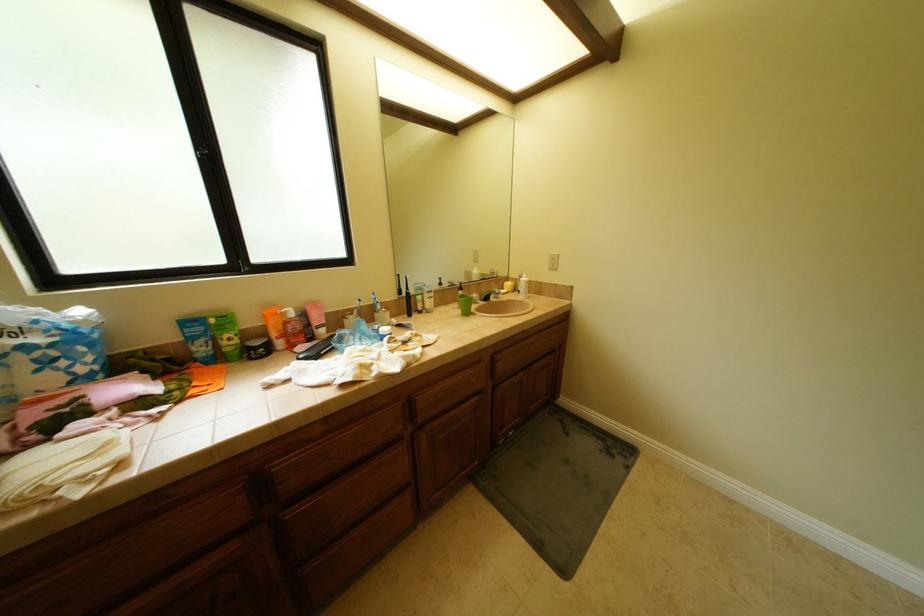
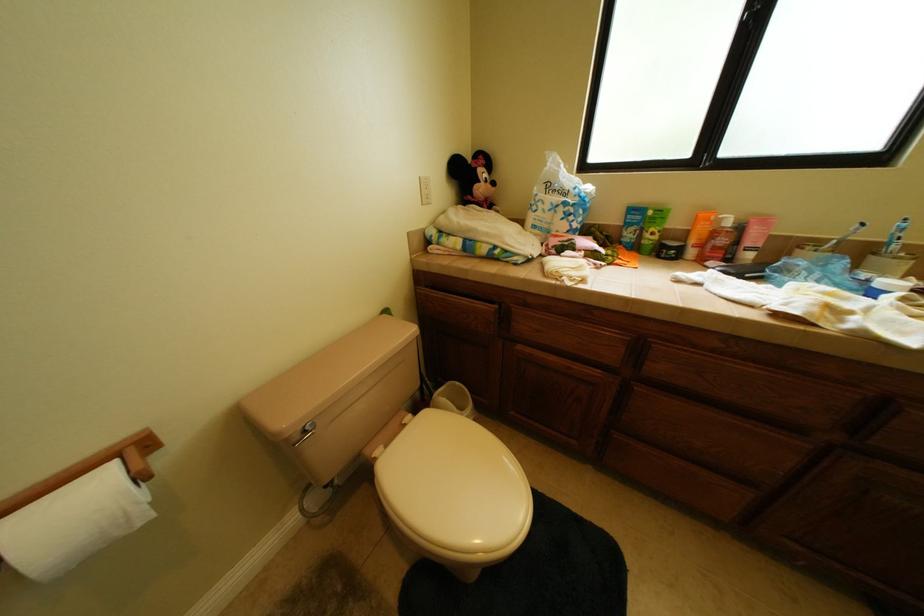
Based on the continuous images, in which direction is the camera rotating?

The camera's rotation is toward left-down.